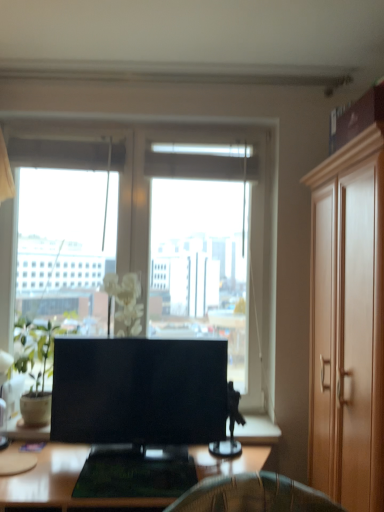
Image resolution: width=384 pixels, height=512 pixels. I want to click on wooden desk at center, so click(x=60, y=484).

Find the location of `green matte plant at left`. green matte plant at left is located at coordinates (39, 371).

Is green matte plant at left positioned beyond the bounds of wooden desk at center?

Yes, green matte plant at left is outside of wooden desk at center.

From a real-world perspective, is green matte plant at left physically located above or below wooden desk at center?

green matte plant at left is above wooden desk at center.

Is point (45, 343) positioned behind point (137, 504)?

Yes, it is behind point (137, 504).

Is wooden desk at center facing towards matte black tv at center?

No, wooden desk at center is not turned towards matte black tv at center.

Based on the photo, is wooden desk at center wider or thinner than matte black tv at center?

wooden desk at center is wider than matte black tv at center.

Identify the location of television above the wooden desk at center (from the image's perspective). The image size is (384, 512). (139, 392).

In the image, is wooden desk at center positioned in front of or behind matte black tv at center?

wooden desk at center is in front of matte black tv at center.

Which is closer to the camera, [30,406] or [69,389]?

The point [69,389] is in front.

Considering the sizes of objects green matte plant at left and matte black tv at center in the image provided, who is wider, green matte plant at left or matte black tv at center?

green matte plant at left is wider.

From a real-world perspective, is green matte plant at left above or below matte black tv at center?

In terms of real-world spatial position, green matte plant at left is above matte black tv at center.

Find the location of a particular element. The width and height of the screenshot is (384, 512). desk lying below the light brown wood cabinet at right (from the image's perspective) is located at coordinates (60, 484).

Can you confirm if light brown wood cabinet at right is positioned to the left of wooden desk at center?

Incorrect, light brown wood cabinet at right is not on the left side of wooden desk at center.

Is light brown wood cabinet at right outside of wooden desk at center?

That's correct, light brown wood cabinet at right is outside of wooden desk at center.

From the image's perspective, is light brown wood cabinet at right on top of wooden desk at center?

Yes, from the image's perspective, light brown wood cabinet at right is on top of wooden desk at center.

From a real-world perspective, which is physically below, matte black tv at center or green matte plant at left?

matte black tv at center.

Locate an element on the screen. The height and width of the screenshot is (512, 384). houseplant above the matte black tv at center (from the image's perspective) is located at coordinates (39, 371).

Does matte black tv at center have a lesser width compared to green matte plant at left?

Correct, the width of matte black tv at center is less than that of green matte plant at left.

Can green matte plant at left be found inside matte black tv at center?

No, green matte plant at left is located outside of matte black tv at center.

Considering the sizes of wooden desk at center and light brown wood cabinet at right in the image, is wooden desk at center bigger or smaller than light brown wood cabinet at right?

In the image, wooden desk at center appears to be smaller than light brown wood cabinet at right.

From a real-world perspective, who is located lower, wooden desk at center or light brown wood cabinet at right?

wooden desk at center, from a real-world perspective.

Is wooden desk at center thinner than light brown wood cabinet at right?

Incorrect, the width of wooden desk at center is not less than that of light brown wood cabinet at right.

Which point is more forward, (75, 479) or (355, 253)?

Point (355, 253)

Is light brown wood cabinet at right next to green matte plant at left?

light brown wood cabinet at right is not next to green matte plant at left, and they're not touching.

Is light brown wood cabinet at right oriented away from green matte plant at left?

light brown wood cabinet at right does not have its back to green matte plant at left.

Between light brown wood cabinet at right and green matte plant at left, which one has smaller size?

With smaller size is green matte plant at left.

Measure the distance between light brown wood cabinet at right and green matte plant at left.

4.05 feet.

This screenshot has height=512, width=384. What are the coordinates of `desk that is in front of the green matte plant at left` in the screenshot? It's located at (60, 484).

Image resolution: width=384 pixels, height=512 pixels. In order to click on television that is behind the wooden desk at center in this screenshot , I will do `click(139, 392)`.

Estimate the real-world distances between objects in this image. Which object is further from wooden desk at center, matte black tv at center or light brown wood cabinet at right?

The object further to wooden desk at center is light brown wood cabinet at right.

When comparing their distances from light brown wood cabinet at right, does wooden desk at center or green matte plant at left seem closer?

The object closer to light brown wood cabinet at right is wooden desk at center.

From the image, which object appears to be nearer to matte black tv at center, light brown wood cabinet at right or green matte plant at left?

green matte plant at left is closer to matte black tv at center.

Considering their positions, is light brown wood cabinet at right positioned further to wooden desk at center than matte black tv at center?

light brown wood cabinet at right is further to wooden desk at center.

Looking at the image, which one is located further to light brown wood cabinet at right, matte black tv at center or wooden desk at center?

Based on the image, wooden desk at center appears to be further to light brown wood cabinet at right.

When comparing their distances from matte black tv at center, does light brown wood cabinet at right or wooden desk at center seem closer?

wooden desk at center lies closer to matte black tv at center than the other object.

Estimate the real-world distances between objects in this image. Which object is further from wooden desk at center, light brown wood cabinet at right or green matte plant at left?

Among the two, light brown wood cabinet at right is located further to wooden desk at center.

Considering their positions, is green matte plant at left positioned further to light brown wood cabinet at right than matte black tv at center?

green matte plant at left.

In order to click on television located between wooden desk at center and light brown wood cabinet at right in the left-right direction in this screenshot , I will do `click(139, 392)`.

I want to click on television between green matte plant at left and light brown wood cabinet at right from left to right, so click(139, 392).

Find the location of a particular element. desk situated between green matte plant at left and light brown wood cabinet at right from left to right is located at coordinates (60, 484).

At what (x,y) coordinates should I click in order to perform the action: click on desk between green matte plant at left and matte black tv at center. Please return your answer as a coordinate pair (x, y). The image size is (384, 512). Looking at the image, I should click on (60, 484).